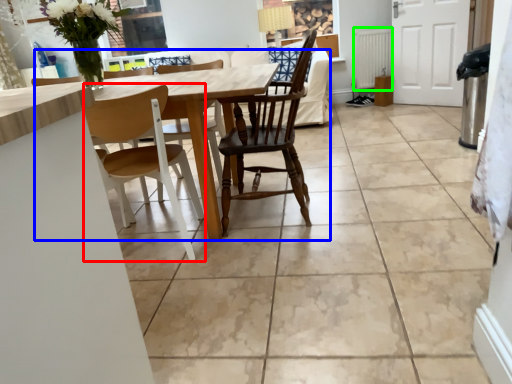
Question: Based on their relative distances, which object is nearer to chair (highlighted by a red box)? Choose from kitchen & dining room table (highlighted by a blue box) and radiator (highlighted by a green box).

Choices:
 (A) kitchen & dining room table
 (B) radiator

Answer: (A)